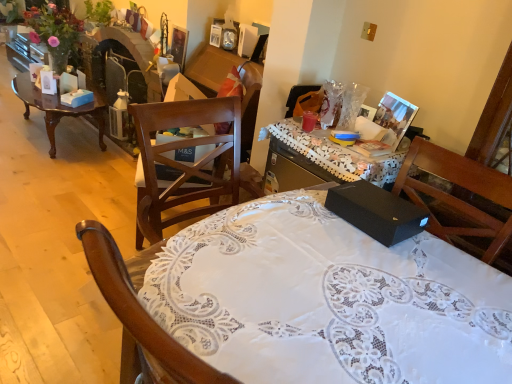
Question: Can you confirm if black matte box at center is smaller than black matte box at center?

Choices:
 (A) yes
 (B) no

Answer: (A)

Question: Is black matte box at center outside black matte box at center?

Choices:
 (A) yes
 (B) no

Answer: (A)

Question: Is black matte box at center positioned in front of black matte box at center?

Choices:
 (A) no
 (B) yes

Answer: (A)

Question: Is black matte box at center touching black matte box at center?

Choices:
 (A) no
 (B) yes

Answer: (A)

Question: Is black matte box at center to the right of black matte box at center from the viewer's perspective?

Choices:
 (A) no
 (B) yes

Answer: (B)

Question: Can you confirm if black matte box at center is wider than black matte box at center?

Choices:
 (A) yes
 (B) no

Answer: (B)

Question: Is brown wooden chair at center shorter than matte plastic cup at center?

Choices:
 (A) yes
 (B) no

Answer: (B)

Question: Considering the relative sizes of brown wooden chair at center and matte plastic cup at center in the image provided, is brown wooden chair at center wider than matte plastic cup at center?

Choices:
 (A) no
 (B) yes

Answer: (B)

Question: Is brown wooden chair at center facing away from matte plastic cup at center?

Choices:
 (A) no
 (B) yes

Answer: (A)

Question: Is brown wooden chair at center oriented towards matte plastic cup at center?

Choices:
 (A) yes
 (B) no

Answer: (B)

Question: Is brown wooden chair at center positioned far away from matte plastic cup at center?

Choices:
 (A) yes
 (B) no

Answer: (B)

Question: Does brown wooden chair at center appear on the left side of matte plastic cup at center?

Choices:
 (A) yes
 (B) no

Answer: (A)

Question: Can you confirm if brown wooden chair at center is taller than wooden polished coffee table at left?

Choices:
 (A) yes
 (B) no

Answer: (A)